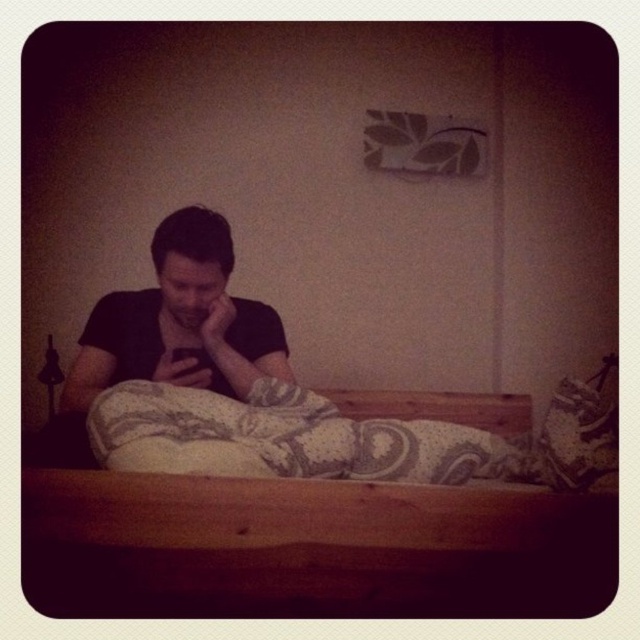
Who is positioned more to the left, wooden bed at center or black matte shirt at center?

From the viewer's perspective, black matte shirt at center appears more on the left side.

Is point (182, 500) positioned after point (147, 300)?

No.

Who is more distant from viewer, (86, 589) or (266, 328)?

Positioned behind is point (266, 328).

What are the coordinates of `wooden bed at center` in the screenshot? It's located at (308, 547).

Who is more forward, (221, 244) or (214, 356)?

Positioned in front is point (221, 244).

Is black matte shirt at center closer to the viewer compared to black matte hand at center?

Yes, black matte shirt at center is closer to the viewer.

At what (x,y) coordinates should I click in order to perform the action: click on black matte shirt at center. Please return your answer as a coordinate pair (x, y). The height and width of the screenshot is (640, 640). Looking at the image, I should click on (176, 316).

Which of these two, matte black hand at lower center or black matte hand at center, stands taller?

black matte hand at center is taller.

The height and width of the screenshot is (640, 640). What are the coordinates of `matte black hand at lower center` in the screenshot? It's located at (180, 369).